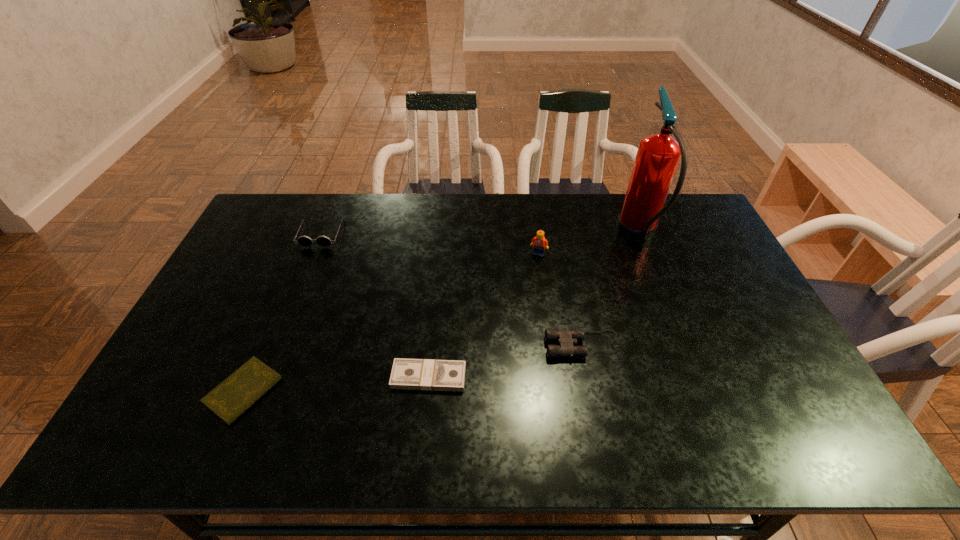
Where is `free space between the binoculars and the dollar`? The height and width of the screenshot is (540, 960). free space between the binoculars and the dollar is located at coordinates (506, 361).

In order to click on empty space that is in between the fifth shortest object and the tallest object in this screenshot , I will do `click(588, 245)`.

Where is `free area in between the tallest object and the Lego`? The image size is (960, 540). free area in between the tallest object and the Lego is located at coordinates (588, 245).

Where is `the second closest object to the dollar`? the second closest object to the dollar is located at coordinates (232, 397).

Locate an element on the screen. The height and width of the screenshot is (540, 960). object that stands as the fifth closest to the dollar is located at coordinates (658, 155).

Locate an element on the screen. The height and width of the screenshot is (540, 960). free location that satisfies the following two spatial constraints: 1. on the back side of the dollar; 2. on the right side of the tallest object is located at coordinates (442, 237).

I want to click on free space that satisfies the following two spatial constraints: 1. on the front-facing side of the third object from left to right; 2. on the left side of the third tallest object, so tap(265, 377).

Where is `free spot that satisfies the following two spatial constraints: 1. on the front-facing side of the fourth shortest object; 2. on the right side of the fourth object from right to left`? free spot that satisfies the following two spatial constraints: 1. on the front-facing side of the fourth shortest object; 2. on the right side of the fourth object from right to left is located at coordinates (265, 377).

You are a GUI agent. You are given a task and a screenshot of the screen. Output one action in this format:
    pyautogui.click(x=<x>, y=<y>)
    Task: Click on the free location that satisfies the following two spatial constraints: 1. on the front-facing side of the sunglasses; 2. on the left side of the fourth object from right to left
    This screenshot has width=960, height=540.
    Given the screenshot: What is the action you would take?
    pyautogui.click(x=265, y=377)